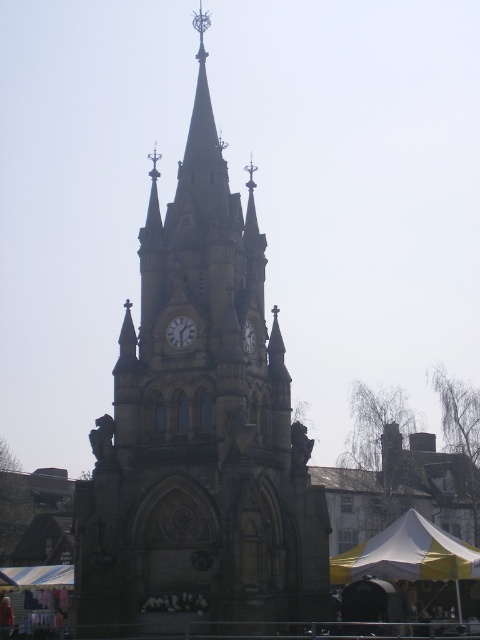
Is matte gray clock at center further to camera compared to matte stone clock at center?

That is False.

Can you confirm if matte gray clock at center is positioned above matte stone clock at center?

No.

Where is `matte gray clock at center`? The image size is (480, 640). matte gray clock at center is located at coordinates (180, 332).

Is stone clock tower at center positioned behind matte gray clock at center?

No, it is in front of matte gray clock at center.

Can you confirm if stone clock tower at center is shorter than matte gray clock at center?

No.

Between point (187, 212) and point (171, 340), which one is positioned behind?

Positioned behind is point (187, 212).

Where is `stone clock tower at center`? stone clock tower at center is located at coordinates (200, 428).

Is stone clock tower at center smaller than matte stone clock at center?

No, stone clock tower at center is not smaller than matte stone clock at center.

Which is above, stone clock tower at center or matte stone clock at center?

stone clock tower at center is higher up.

Between point (156, 522) and point (245, 321), which one is positioned in front?

Point (156, 522)

Where is `stone clock tower at center`? This screenshot has height=640, width=480. stone clock tower at center is located at coordinates (200, 428).